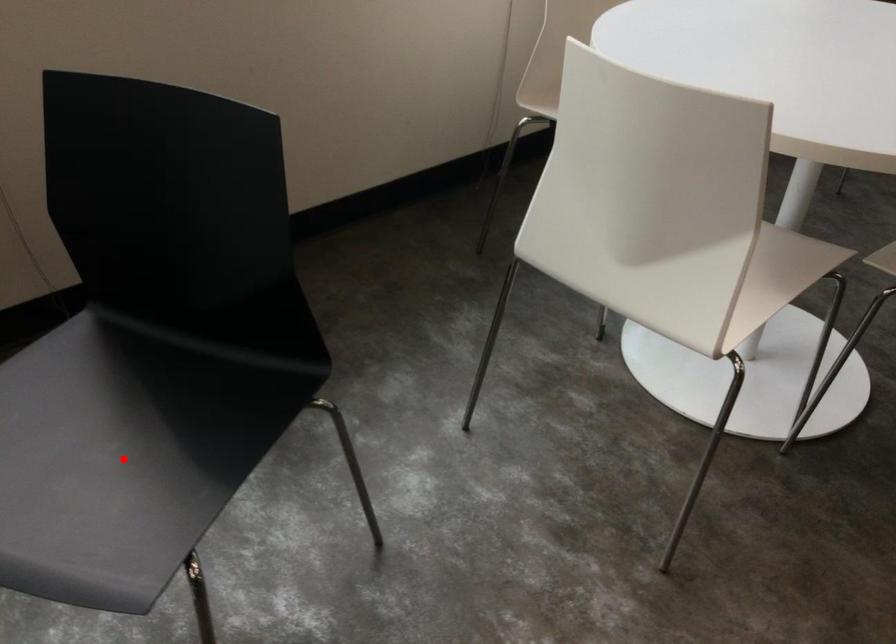
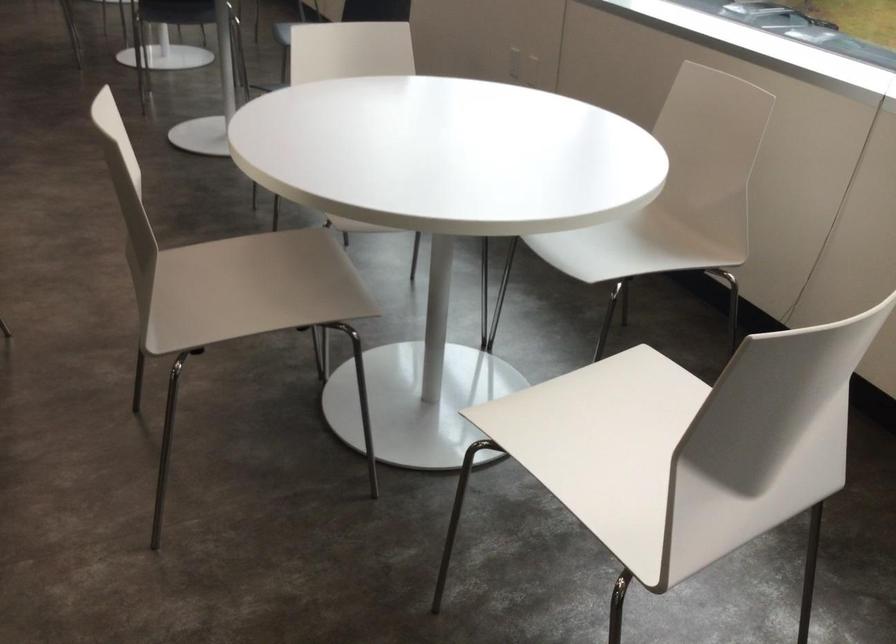
Question: I am providing you with two images of the same scene from different viewpoints. A red point is marked on the first image. At the location where the point appears in image 1, is it still visible in image 2?

Choices:
 (A) Yes
 (B) No

Answer: (B)